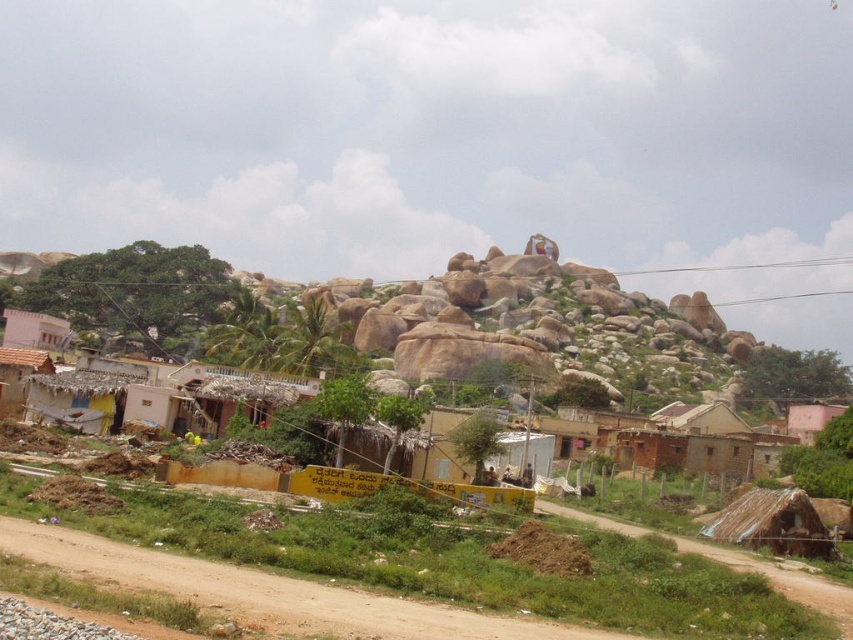
Question: Which point appears farthest from the camera in this image?

Choices:
 (A) (26, 346)
 (B) (705, 534)

Answer: (A)

Question: Which object appears farthest from the camera in this image?

Choices:
 (A) light pink painted wall at lower left
 (B) rusty corrugated hut at lower right
 (C) brown dirt track at lower left

Answer: (A)

Question: Does brown dirt track at lower left have a greater width compared to rusty corrugated hut at lower right?

Choices:
 (A) no
 (B) yes

Answer: (B)

Question: Is rusty corrugated hut at lower right above light pink painted wall at lower left?

Choices:
 (A) no
 (B) yes

Answer: (A)

Question: Which object is farther from the camera taking this photo?

Choices:
 (A) brown dirt track at lower left
 (B) light pink painted wall at lower left
 (C) rusty corrugated hut at lower right

Answer: (B)

Question: Can you confirm if brown dirt track at lower left is positioned above light pink painted wall at lower left?

Choices:
 (A) no
 (B) yes

Answer: (A)